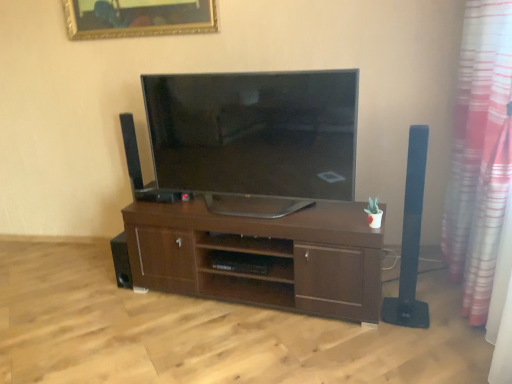
The width and height of the screenshot is (512, 384). Identify the location of free spot in front of black matte speaker at right, which is the 3th speaker in back-to-front order. (419, 338).